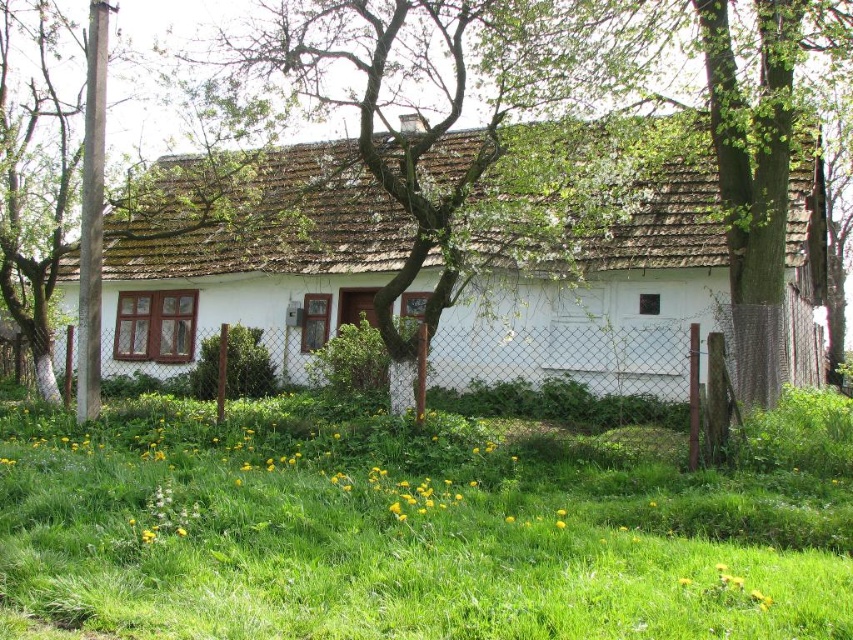
You are standing at the entrance of the house and want to walk towards the green grass at lower center. What are the coordinates you should head towards?

The coordinates you should head towards are point (401, 531).

You are standing outside the property looking at the green grass at lower center and the white matte house at center. Which object is nearer to you?

The green grass at lower center is closer to the viewer than the white matte house at center.